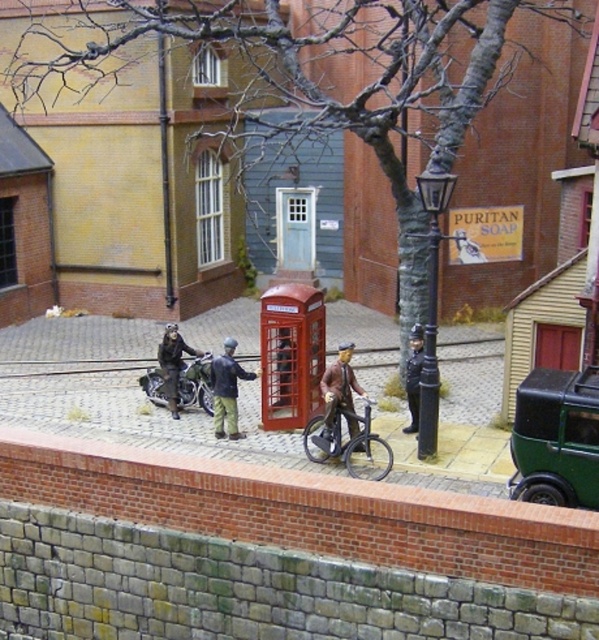
You are standing at the center of the cobblestone street in the historical diorama. You notice a green matte car at lower right located at point [556,438]. If you want to reach this car, which direction should you move relative to your current position?

You should move towards the lower right direction to reach the green matte car at lower right located at point [556,438].

You are a visitor in this miniature diorama and want to know which object is shorter between the shiny silver bicycle at center and the dark blue fabric jacket at center. According to the scene, which one is shorter?

The shiny silver bicycle at center is shorter than the dark blue fabric jacket at center.

You are a miniature figure trying to cross the street. You have a brown leather jacket at center and see a metallic silver train track at center. Which object is wider so you can step on it safely?

The metallic silver train track at center is wider than the brown leather jacket at center, so you can step on the metallic silver train track at center safely.